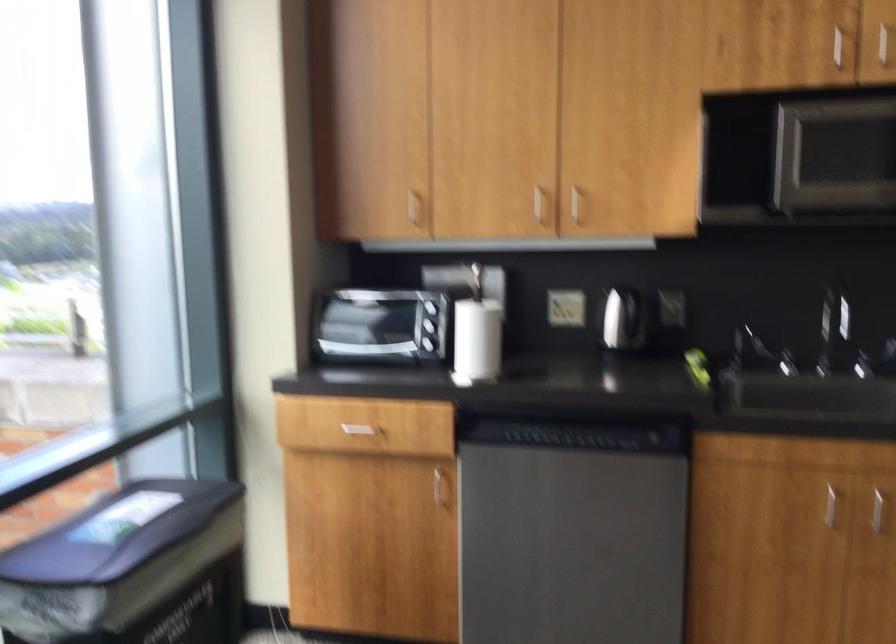
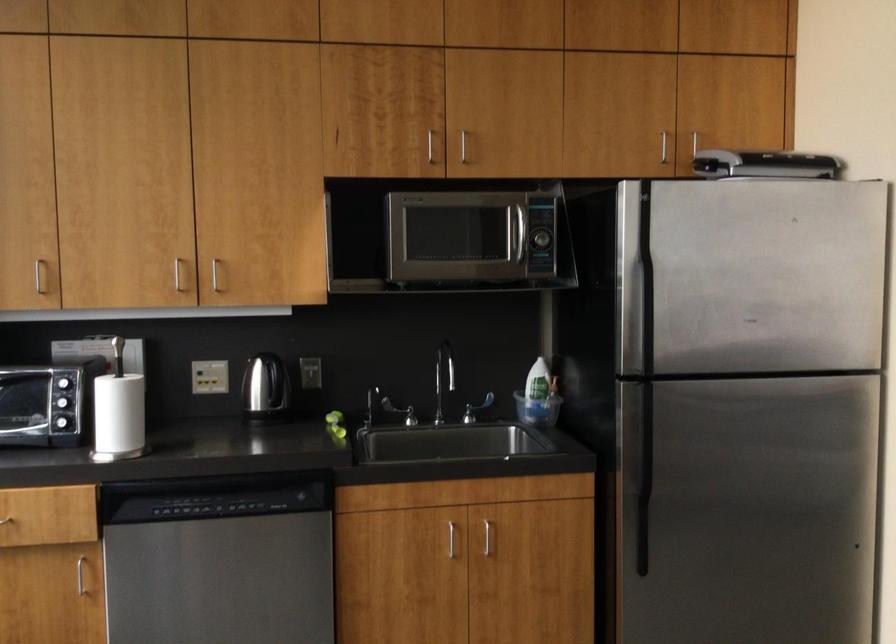
Question: The images are taken continuously from a first-person perspective. In which direction is your viewpoint rotating?

Choices:
 (A) Left
 (B) Right
 (C) Up
 (D) Down

Answer: (B)